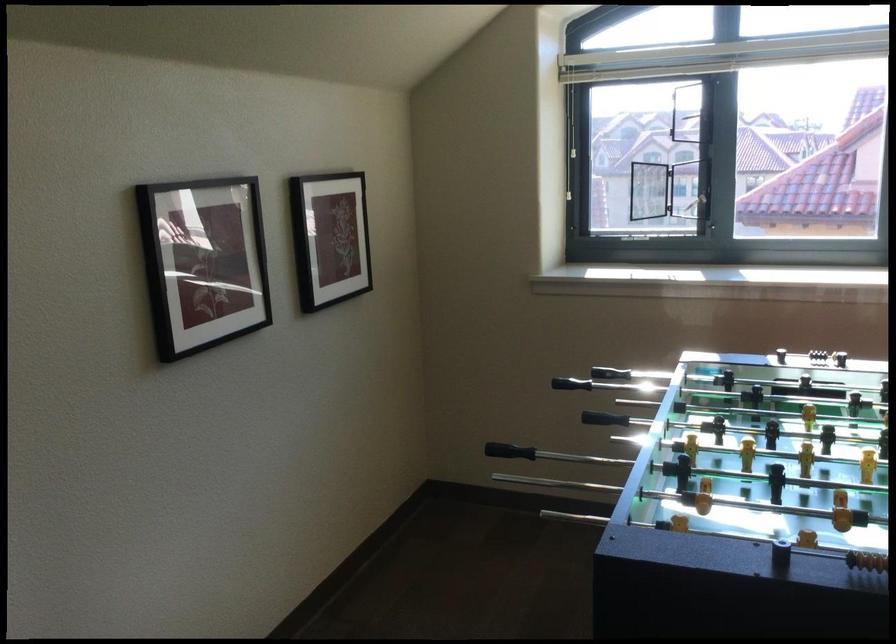
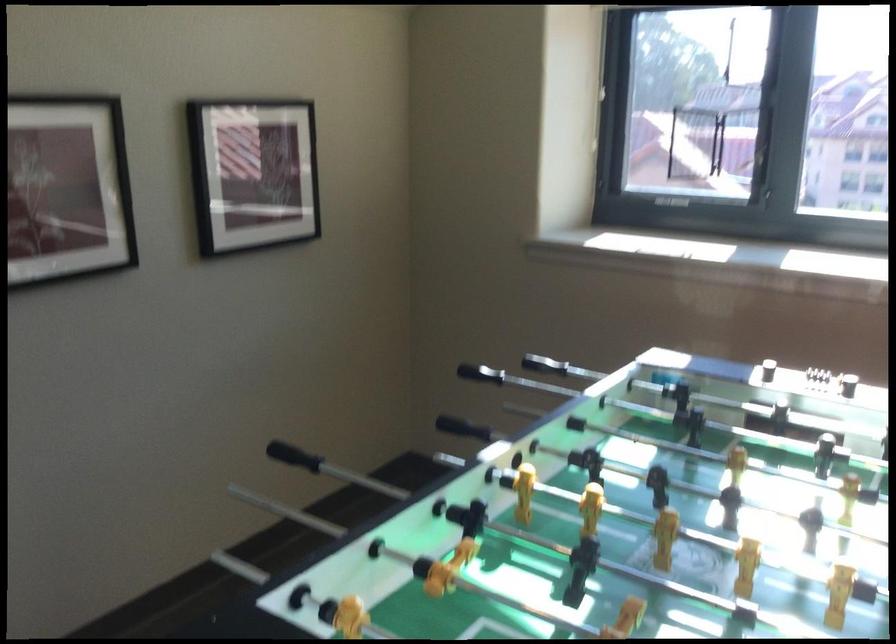
Where in the second image is the point corresponding to [488,435] from the first image?

(463, 428)